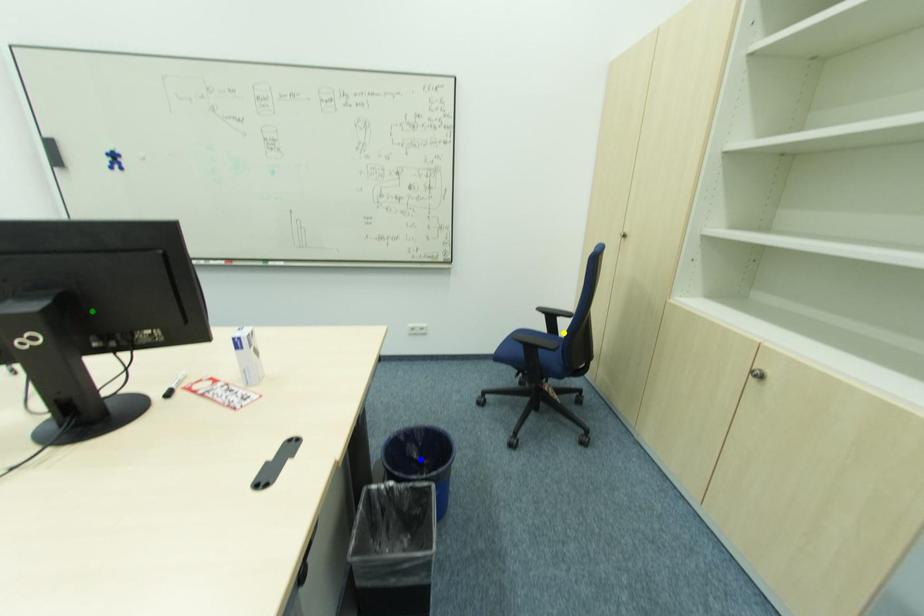
Order these from nearest to farthest:
1. yellow point
2. blue point
3. green point

yellow point → blue point → green point